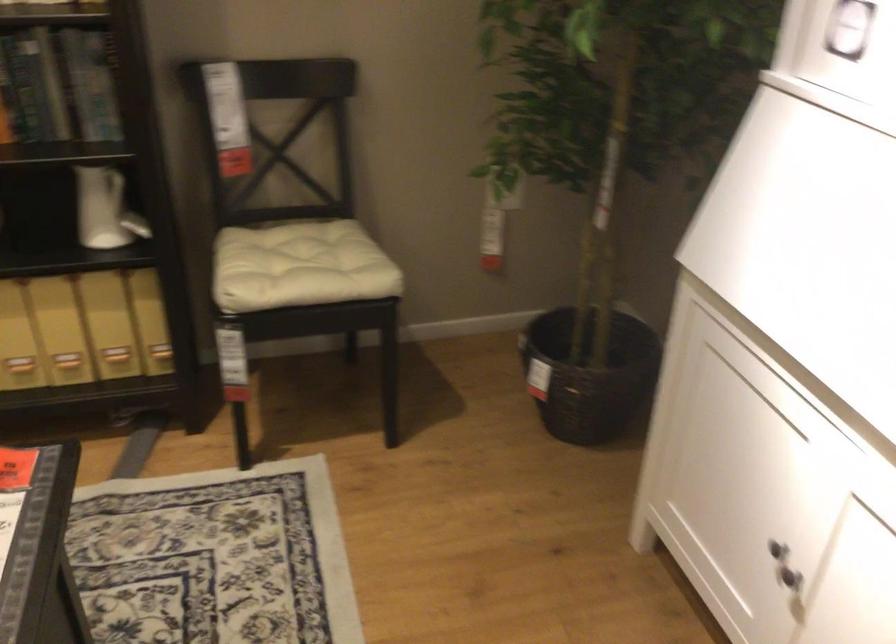
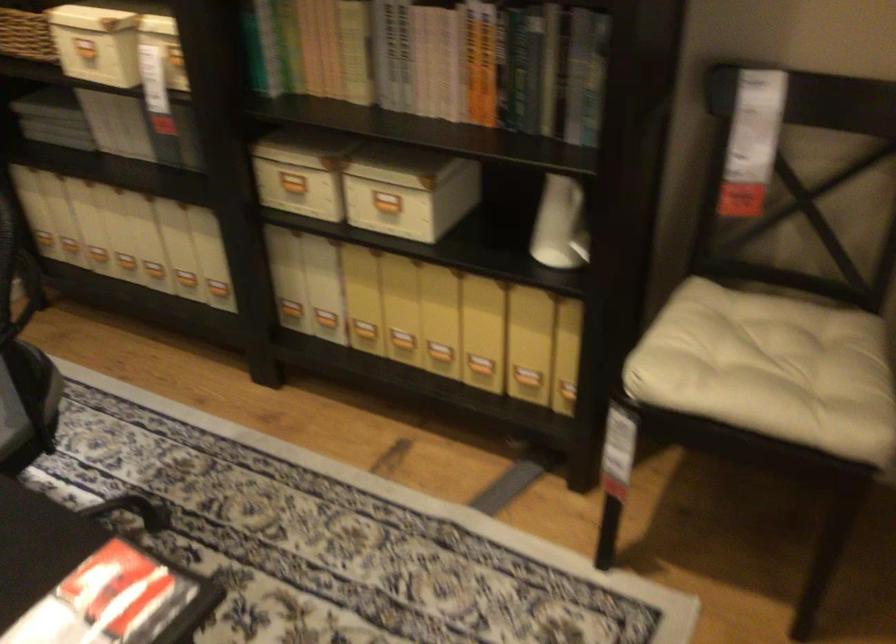
Locate, in the second image, the point that corresponds to (x=117, y=225) in the first image.

(582, 238)